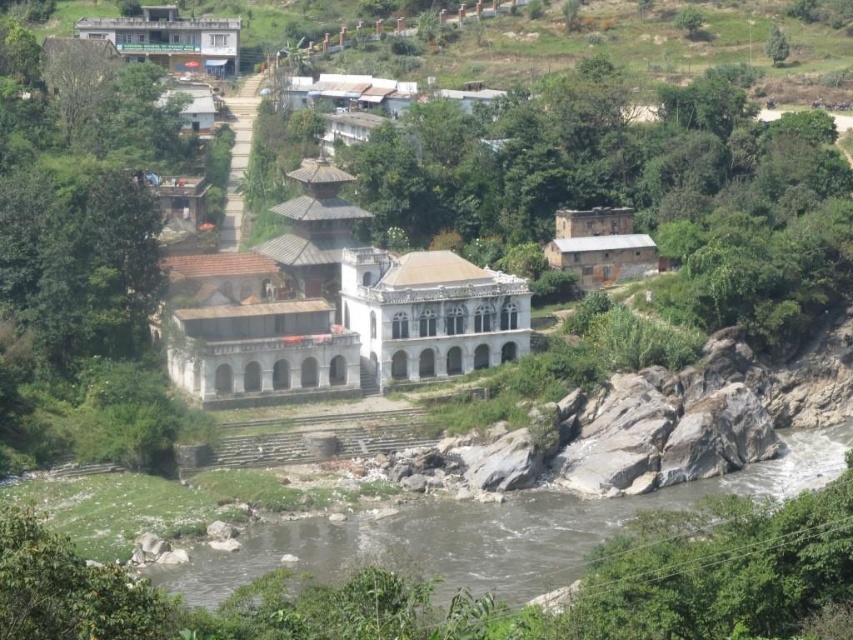
Question: Is white stone palace at center to the right of brown rocky river at lower center from the viewer's perspective?

Choices:
 (A) no
 (B) yes

Answer: (A)

Question: Does white stone palace at center lie in front of white stone palace at upper center?

Choices:
 (A) no
 (B) yes

Answer: (B)

Question: Which is farther from the brown stone building at upper right?

Choices:
 (A) white stone palace at upper center
 (B) white stone palace at center
 (C) brown rocky river at lower center

Answer: (A)

Question: Can you confirm if white stone palace at center is positioned to the right of white stone palace at upper center?

Choices:
 (A) yes
 (B) no

Answer: (A)

Question: Estimate the real-world distances between objects in this image. Which object is closer to the brown rocky river at lower center?

Choices:
 (A) white stone palace at upper center
 (B) white stone palace at center
 (C) brown stone building at upper right

Answer: (B)

Question: Among these objects, which one is farthest from the camera?

Choices:
 (A) white stone palace at upper center
 (B) brown stone building at upper right

Answer: (A)